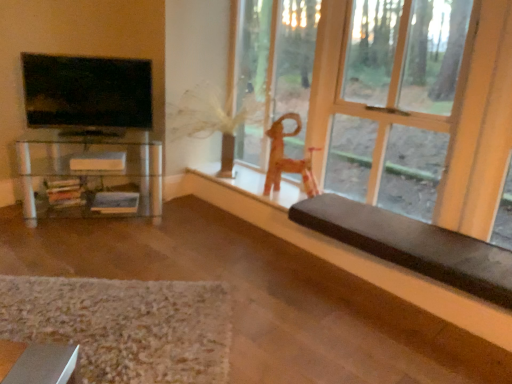
Question: Looking at their shapes, would you say wooden chair at right is wider or thinner than textured beige rug at lower left?

Choices:
 (A) thin
 (B) wide

Answer: (A)

Question: Considering their positions, is wooden chair at right located in front of or behind textured beige rug at lower left?

Choices:
 (A) front
 (B) behind

Answer: (B)

Question: Considering the real-world distances, which object is farthest from the clear glass shelf at left?

Choices:
 (A) brown cushioned bench at lower right
 (B) matte black tv at left
 (C) black leather bench at lower right
 (D) wooden chair at right
 (E) textured beige rug at lower left

Answer: (D)

Question: Considering the real-world distances, which object is closest to the wooden chair at right?

Choices:
 (A) textured beige rug at lower left
 (B) clear glass shelf at left
 (C) matte black tv at left
 (D) brown cushioned bench at lower right
 (E) wooden toy horse at center

Answer: (E)